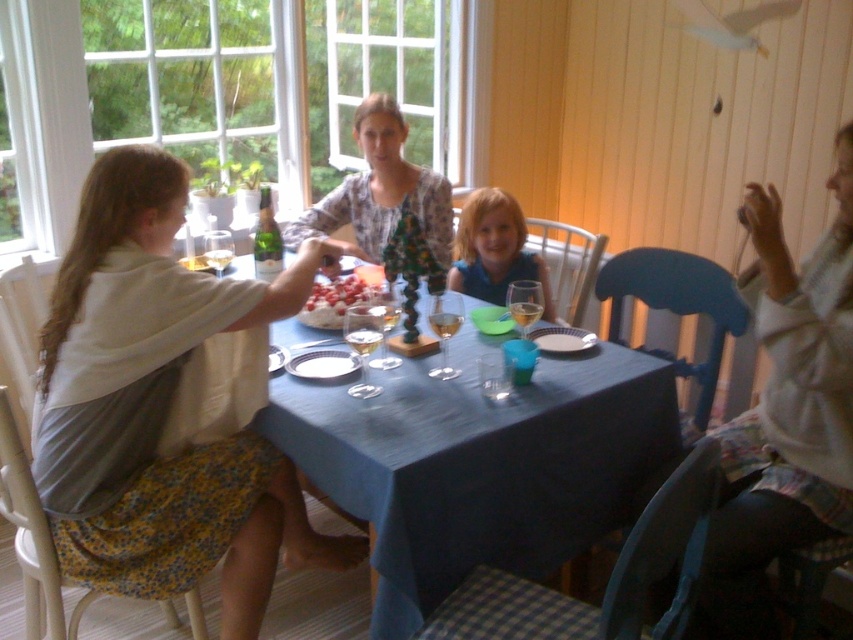
Based on the scene description, which clothing item is positioned higher on the person wearing both the floral print blouse at center and the blue fabric shirt at center?

The floral print blouse at center is positioned higher because it is above the blue fabric shirt at center.

You are a photographer trying to capture a candid shot of the matte white blouse at upper left and the blue fabric table at center. Since you want to ensure both are in focus, which object should you focus on first to account for their positions?

The matte white blouse at upper left is located above the blue fabric table at center, so you should focus on the blue fabric table at center first since it is closer to the camera.